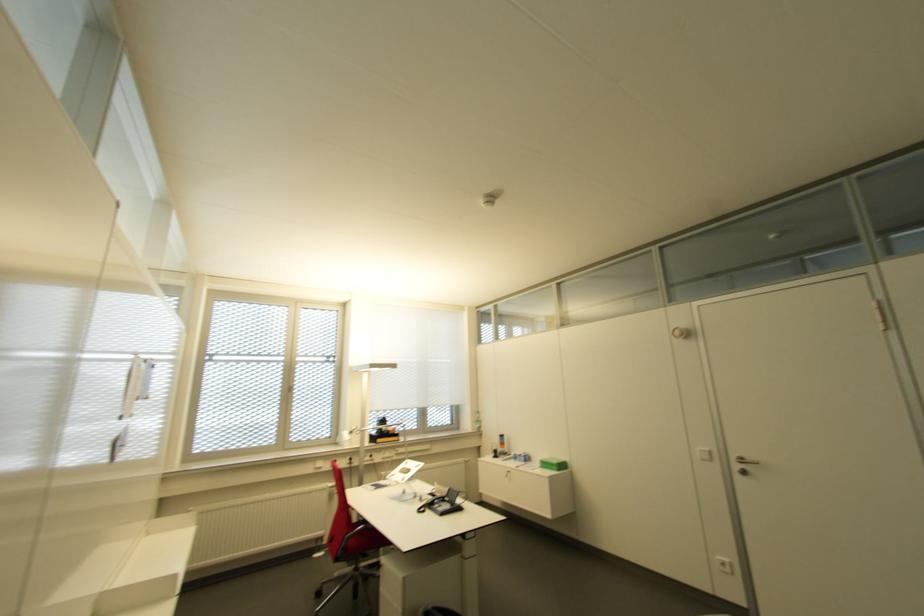
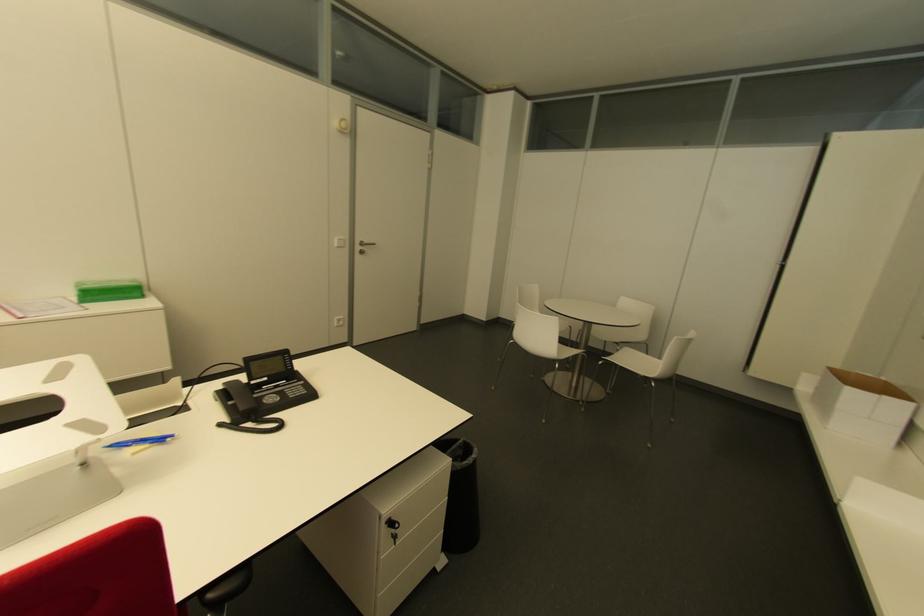
Where in the second image is the point corresponding to (x=709, y=453) from the first image?

(343, 240)